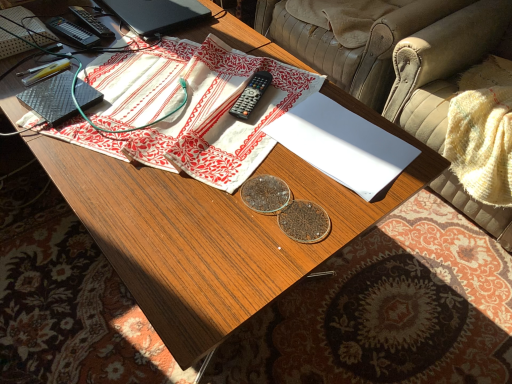
Question: In terms of width, does white paper at center look wider or thinner when compared to black matte laptop at upper left?

Choices:
 (A) wide
 (B) thin

Answer: (A)

Question: Is white paper at center bigger or smaller than black matte laptop at upper left?

Choices:
 (A) big
 (B) small

Answer: (B)

Question: Which of these objects is positioned closest to the white cotton cloth at center?

Choices:
 (A) white paper at center
 (B) leather armchair at upper right, the second armchair from the front
 (C) beige leather armchair at upper right, which is counted as the 1th armchair, starting from the front
 (D) black plastic remote at center
 (E) black matte laptop at upper left

Answer: (D)

Question: Which is farther from the white paper at center?

Choices:
 (A) beige leather armchair at upper right, which is counted as the 1th armchair, starting from the front
 (B) black matte laptop at upper left
 (C) white cotton cloth at center
 (D) leather armchair at upper right, placed as the 1th armchair when sorted from back to front
 (E) black plastic remote at center

Answer: (D)